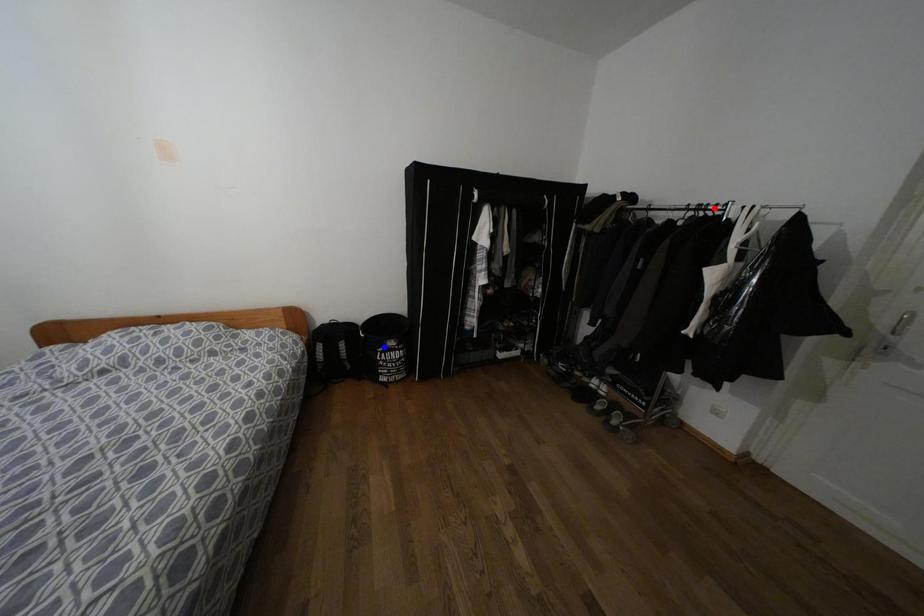
Question: Which of the two points in the image is closer to the camera?

Choices:
 (A) Blue point is closer.
 (B) Red point is closer.

Answer: (B)